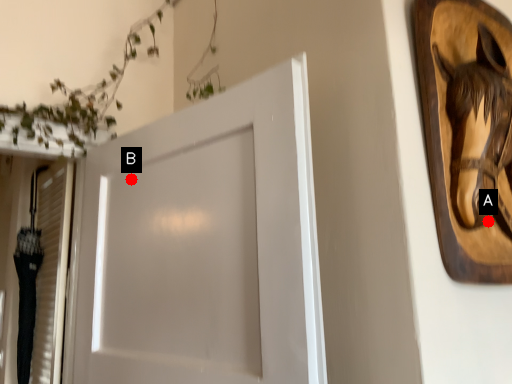
Question: Two points are circled on the image, labeled by A and B beside each circle. Which point is closer to the camera taking this photo?

Choices:
 (A) A is closer
 (B) B is closer

Answer: (A)